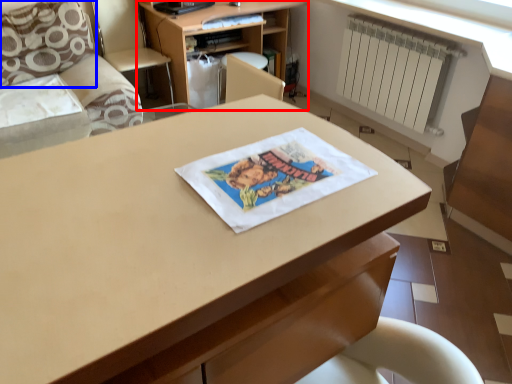
Question: Which point is closer to the camera, shelf (highlighted by a red box) or pillow (highlighted by a blue box)?

Choices:
 (A) shelf
 (B) pillow

Answer: (B)